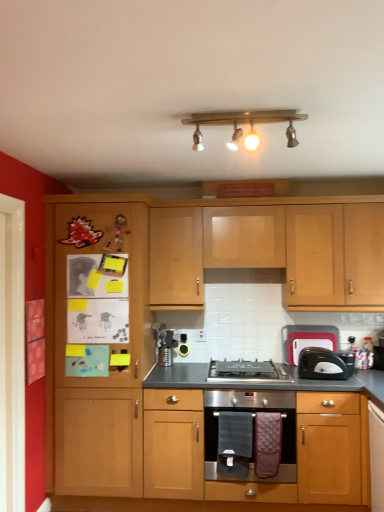
Question: From the image's perspective, would you say black plastic toaster at right is shown under wooden cabinet at left?

Choices:
 (A) yes
 (B) no

Answer: (A)

Question: Can you confirm if black plastic toaster at right is wider than wooden cabinet at left?

Choices:
 (A) no
 (B) yes

Answer: (A)

Question: Would you say black plastic toaster at right is outside wooden cabinet at left?

Choices:
 (A) yes
 (B) no

Answer: (A)

Question: From a real-world perspective, is black plastic toaster at right physically above wooden cabinet at left?

Choices:
 (A) no
 (B) yes

Answer: (A)

Question: Is black plastic toaster at right smaller than wooden cabinet at left?

Choices:
 (A) no
 (B) yes

Answer: (B)

Question: Considering the relative sizes of black plastic toaster at right and wooden cabinet at left in the image provided, is black plastic toaster at right taller than wooden cabinet at left?

Choices:
 (A) yes
 (B) no

Answer: (B)

Question: Does stainless steel oven at center have a larger size compared to wooden cabinet at left?

Choices:
 (A) yes
 (B) no

Answer: (B)

Question: Is stainless steel oven at center thinner than wooden cabinet at left?

Choices:
 (A) no
 (B) yes

Answer: (B)

Question: Does stainless steel oven at center have a greater width compared to wooden cabinet at left?

Choices:
 (A) no
 (B) yes

Answer: (A)

Question: Is stainless steel oven at center facing away from wooden cabinet at left?

Choices:
 (A) yes
 (B) no

Answer: (B)

Question: From the image's perspective, is stainless steel oven at center located above wooden cabinet at left?

Choices:
 (A) yes
 (B) no

Answer: (B)

Question: Is stainless steel oven at center far from wooden cabinet at left?

Choices:
 (A) no
 (B) yes

Answer: (A)

Question: Is black plastic toaster at right wider than black plastic toaster at right?

Choices:
 (A) yes
 (B) no

Answer: (B)